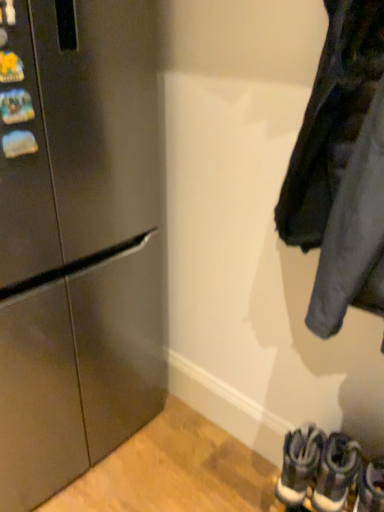
Question: Based on their sizes in the image, would you say dark gray suede sneakers at lower right, the 2th footwear from the right, is bigger or smaller than stainless steel refrigerator at left?

Choices:
 (A) small
 (B) big

Answer: (A)

Question: From a real-world perspective, is dark gray suede sneakers at lower right, the 2th footwear from the right, positioned above or below stainless steel refrigerator at left?

Choices:
 (A) below
 (B) above

Answer: (A)

Question: Which object is the farthest from the white leather sneakers at lower right, the first footwear positioned from the left?

Choices:
 (A) white leather sneakers at lower right, the first footwear in the right-to-left sequence
 (B) dark gray suede sneakers at lower right, which is counted as the second footwear, starting from the left
 (C) dark gray fabric jacket at right
 (D) stainless steel refrigerator at left

Answer: (D)

Question: Which object is positioned closest to the stainless steel refrigerator at left?

Choices:
 (A) white leather sneakers at lower right, the first footwear in the right-to-left sequence
 (B) dark gray fabric jacket at right
 (C) white leather sneakers at lower right, the first footwear positioned from the left
 (D) dark gray suede sneakers at lower right, which is counted as the second footwear, starting from the left

Answer: (B)